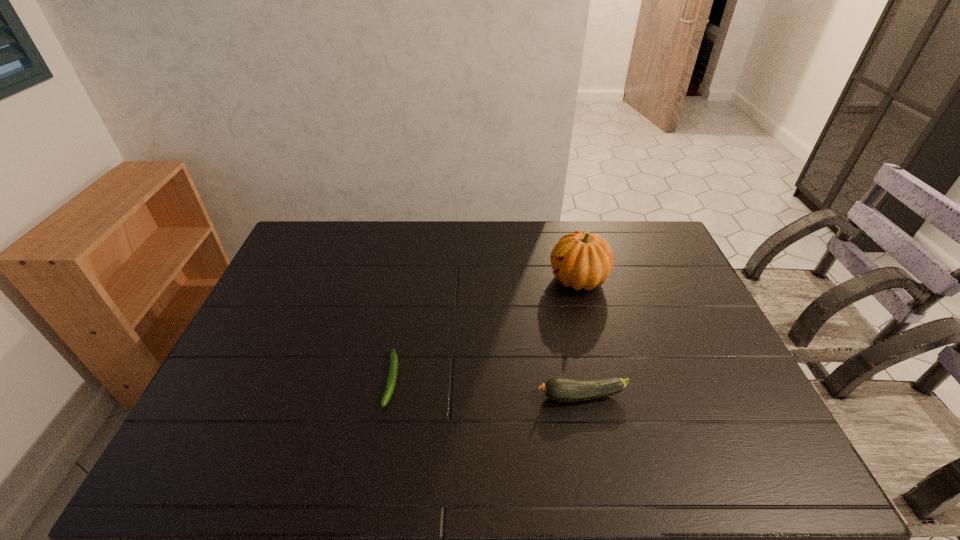
Locate an element on the screen. The height and width of the screenshot is (540, 960). free point that satisfies the following two spatial constraints: 1. on the carved face of the pumpkin; 2. on the front-facing side of the shorter zucchini is located at coordinates (604, 380).

Locate an element on the screen. vacant space that satisfies the following two spatial constraints: 1. on the carved face of the tallest object; 2. on the front-facing side of the leftmost object is located at coordinates (604, 380).

Locate an element on the screen. Image resolution: width=960 pixels, height=540 pixels. free spot that satisfies the following two spatial constraints: 1. on the carved face of the tallest object; 2. on the front-facing side of the left zucchini is located at coordinates (604, 380).

Locate an element on the screen. free spot that satisfies the following two spatial constraints: 1. on the carved face of the tallest object; 2. on the front-facing side of the left zucchini is located at coordinates (604, 380).

Image resolution: width=960 pixels, height=540 pixels. I want to click on free space that satisfies the following two spatial constraints: 1. on the carved face of the pumpkin; 2. on the front-facing side of the left zucchini, so click(604, 380).